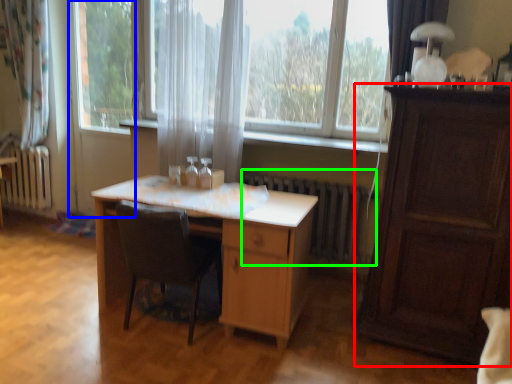
Question: Which object is the farthest from cabinetry (highlighted by a red box)? Choose among these: screen door (highlighted by a blue box) or radiator (highlighted by a green box).

Choices:
 (A) screen door
 (B) radiator

Answer: (A)